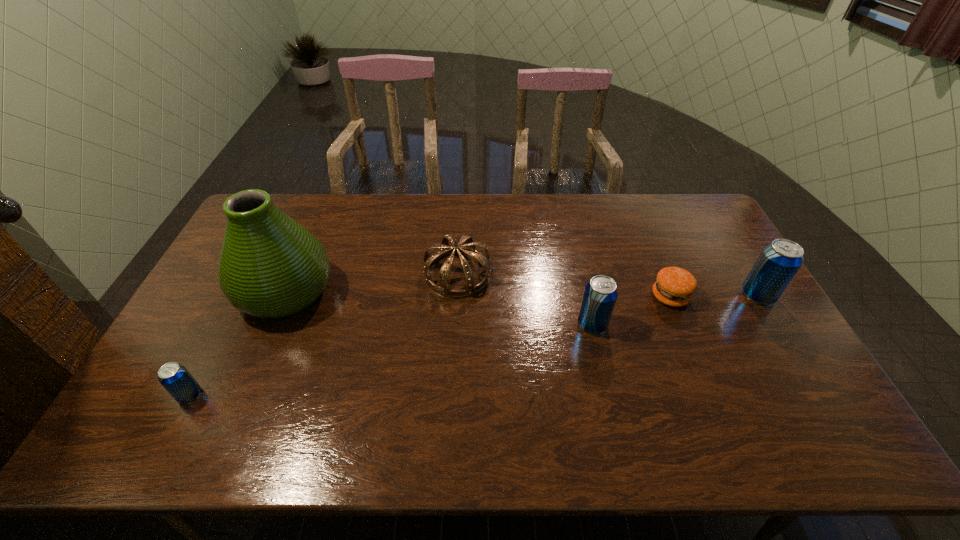
To achieve uniform spacing by inserting another beer_can among them, please point to a free space for this new beer_can. Please provide its 2D coordinates. Your answer should be formatted as a tuple, i.e. [(x, y)], where the tuple contains the x and y coordinates of a point satisfying the conditions above.

[(404, 357)]